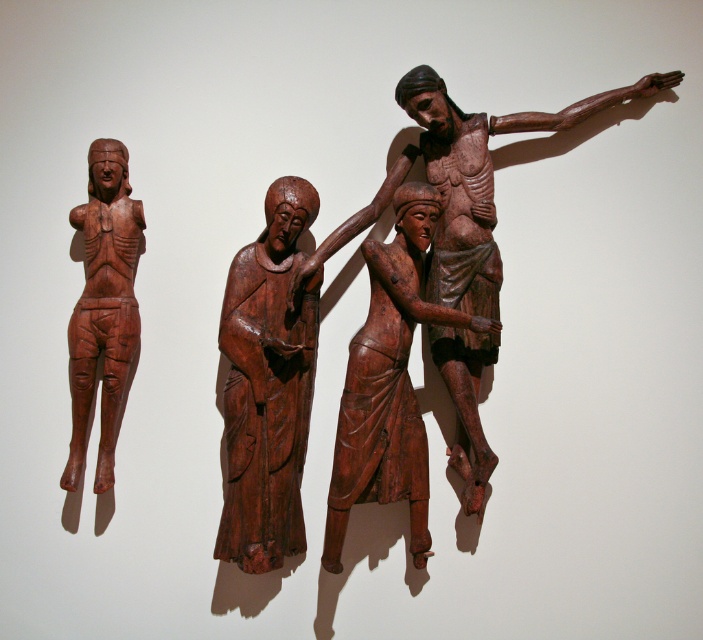
Can you confirm if wooden crucifix at center is positioned above matte wood figure at left?

Yes.

Does point (465, 276) come behind point (134, 365)?

No, (465, 276) is closer to viewer.

The image size is (703, 640). Identify the location of wooden crucifix at center. (463, 184).

Locate an element on the screen. smooth brown statue at center is located at coordinates (266, 385).

Which of these two, wooden figure at center or matte wood figure at left, stands taller?

With more height is wooden figure at center.

Does point (380, 486) lie in front of point (105, 353)?

Yes, point (380, 486) is closer to viewer.

Where is `wooden figure at center`? wooden figure at center is located at coordinates (389, 381).